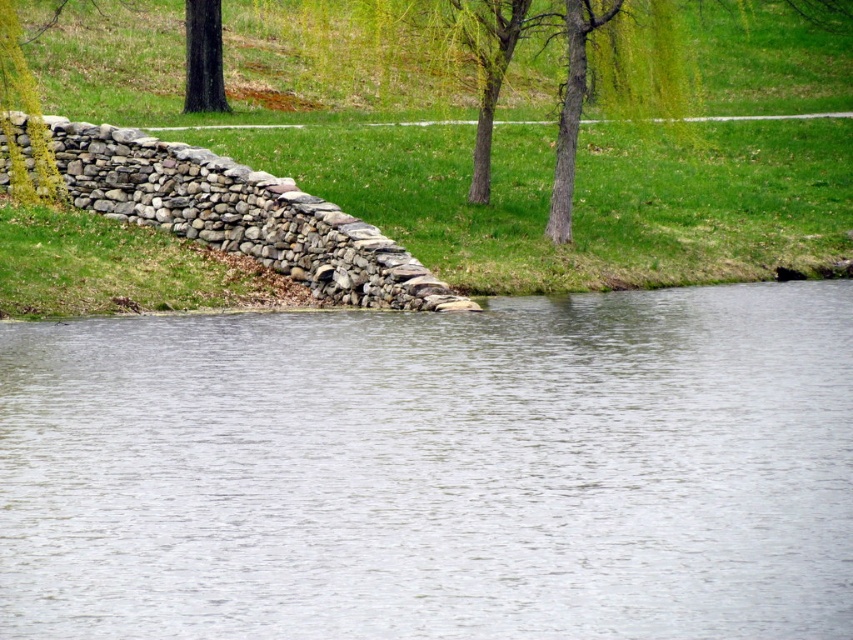
In the scene shown: You are standing at the edge of the clear water at center and want to look at the dark brown bark tree at upper left. Which direction should you turn your head to see the tree?

The dark brown bark tree at upper left is taller than the clear water at center, so you should look upward to see it.

You are standing at the edge of the water and looking towards the stone wall. Which object, the green grass at upper center or the dark brown bark tree at upper left, is positioned higher in the scene?

Result: The green grass at upper center is positioned higher than the dark brown bark tree at upper left in the scene.